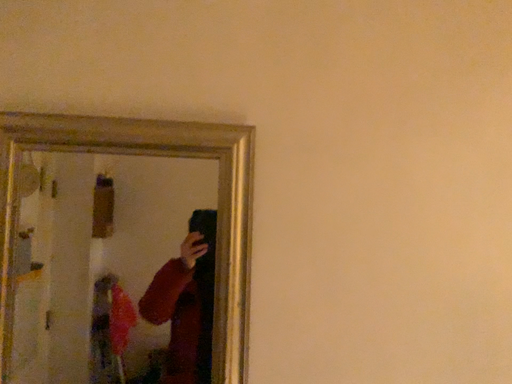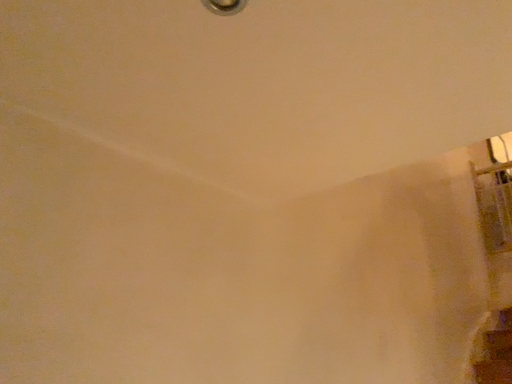
Question: Which way did the camera rotate in the video?

Choices:
 (A) rotated right
 (B) rotated left

Answer: (A)